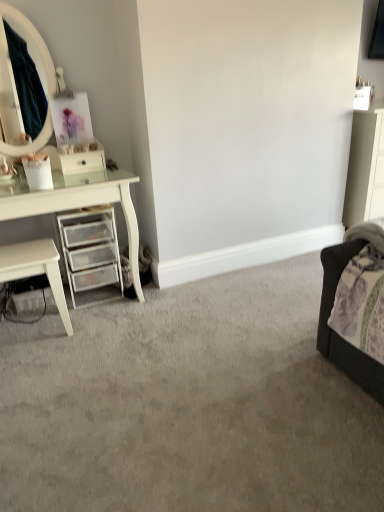
This screenshot has width=384, height=512. I want to click on clear plastic drawers at left, so click(90, 251).

From the picture: What is the approximate width of white glossy drawer at left?

It is 7.04 inches.

The image size is (384, 512). What do you see at coordinates (82, 162) in the screenshot?
I see `white glossy drawer at left` at bounding box center [82, 162].

This screenshot has width=384, height=512. What do you see at coordinates (36, 269) in the screenshot? I see `white glossy nightstand at left` at bounding box center [36, 269].

The image size is (384, 512). What are the coordinates of `clear plastic drawers at left` in the screenshot? It's located at (90, 251).

Does white glossy drawer at left have a greater width compared to white glossy nightstand at left?

No, white glossy drawer at left is not wider than white glossy nightstand at left.

Is white glossy drawer at left bigger than white glossy nightstand at left?

Actually, white glossy drawer at left might be smaller than white glossy nightstand at left.

Is white glossy drawer at left situated inside white glossy nightstand at left or outside?

The correct answer is: outside.

Is clear plastic drawers at left smaller than white glossy drawer at left?

Incorrect, clear plastic drawers at left is not smaller in size than white glossy drawer at left.

From a real-world perspective, which is physically below, clear plastic drawers at left or white glossy drawer at left?

clear plastic drawers at left is physically lower.

Can you confirm if clear plastic drawers at left is taller than white glossy drawer at left?

Indeed, clear plastic drawers at left has a greater height compared to white glossy drawer at left.

Would you consider clear plastic drawers at left to be distant from white glossy drawer at left?

No, clear plastic drawers at left is not far from white glossy drawer at left.

Do you think clear plastic drawers at left is within white glossy nightstand at left, or outside of it?

clear plastic drawers at left is spatially situated outside white glossy nightstand at left.

Is white glossy nightstand at left at the back of clear plastic drawers at left?

clear plastic drawers at left does not have its back to white glossy nightstand at left.

Between clear plastic drawers at left and white glossy nightstand at left, which one has less height?

Standing shorter between the two is white glossy nightstand at left.

Which is closer to the camera, (104, 211) or (45, 258)?

Positioned in front is point (45, 258).

Considering the positions of objects white glossy nightstand at left and clear plastic drawers at left in the image provided, who is more to the left, white glossy nightstand at left or clear plastic drawers at left?

From the viewer's perspective, white glossy nightstand at left appears more on the left side.

Is white glossy nightstand at left not near clear plastic drawers at left?

white glossy nightstand at left is actually quite close to clear plastic drawers at left.

From the image's perspective, who appears lower, white glossy nightstand at left or clear plastic drawers at left?

white glossy nightstand at left, from the image's perspective.

Which of these two, white glossy drawer at left or clear plastic drawers at left, stands shorter?

white glossy drawer at left is shorter.

From the picture: Is clear plastic drawers at left inside white glossy drawer at left?

Definitely not — clear plastic drawers at left is not inside white glossy drawer at left.

Is white glossy drawer at left positioned far away from clear plastic drawers at left?

That's not correct — white glossy drawer at left is a little close to clear plastic drawers at left.

Is white glossy nightstand at left not close to white glossy drawer at left?

No, white glossy nightstand at left is not far from white glossy drawer at left.

From a real-world perspective, is white glossy nightstand at left on white glossy drawer at left?

No, from a real-world perspective, white glossy nightstand at left is not above white glossy drawer at left.

Which of these two, white glossy nightstand at left or white glossy drawer at left, is thinner?

white glossy drawer at left.

Is white glossy nightstand at left oriented away from white glossy drawer at left?

No, white glossy nightstand at left is not facing the opposite direction of white glossy drawer at left.

Identify the location of drawer located above the white glossy nightstand at left (from a real-world perspective). Image resolution: width=384 pixels, height=512 pixels. (82, 162).

This screenshot has width=384, height=512. In the image, there is a white glossy drawer at left. Identify the location of the chest of drawers below it (from a real-world perspective). (90, 251).

When comparing their distances from white glossy drawer at left, does clear plastic drawers at left or white glossy nightstand at left seem closer?

clear plastic drawers at left lies closer to white glossy drawer at left than the other object.

Which object lies further to the anchor point white glossy drawer at left, white glossy nightstand at left or clear plastic drawers at left?

white glossy nightstand at left is positioned further to the anchor white glossy drawer at left.

From the image, which object appears to be nearer to white glossy nightstand at left, clear plastic drawers at left or white glossy drawer at left?

clear plastic drawers at left lies closer to white glossy nightstand at left than the other object.

From the image, which object appears to be farther from clear plastic drawers at left, white glossy nightstand at left or white glossy drawer at left?

Among the two, white glossy drawer at left is located further to clear plastic drawers at left.

Based on their spatial positions, is white glossy drawer at left or white glossy nightstand at left further from clear plastic drawers at left?

white glossy drawer at left is further to clear plastic drawers at left.

When comparing their distances from white glossy nightstand at left, does white glossy drawer at left or clear plastic drawers at left seem further?

Among the two, white glossy drawer at left is located further to white glossy nightstand at left.

Locate an element on the screen. The height and width of the screenshot is (512, 384). the chest of drawers that lies between white glossy drawer at left and white glossy nightstand at left from top to bottom is located at coordinates (90, 251).